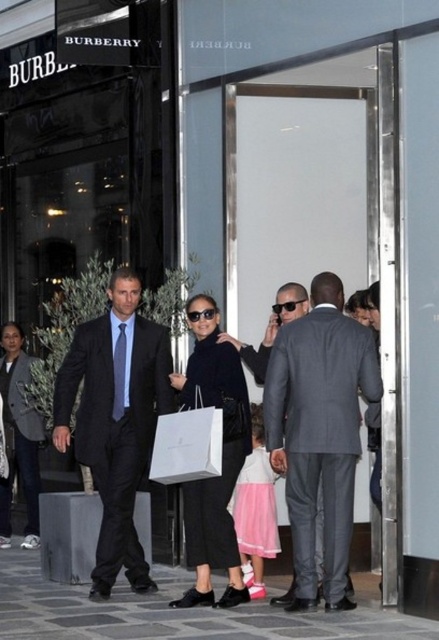
Question: Which object is farther from the camera taking this photo?

Choices:
 (A) pink satin dress at center
 (B) black leather coat at center

Answer: (A)

Question: Estimate the real-world distances between objects in this image. Which object is farther from the pink satin dress at center?

Choices:
 (A) matte black tie at left
 (B) gray suit at center
 (C) dark blue suit at center

Answer: (A)

Question: Is gray suit at center above pink satin dress at center?

Choices:
 (A) no
 (B) yes

Answer: (B)

Question: Which of the following is the closest to the observer?

Choices:
 (A) dark gray textured suit at left
 (B) black leather coat at center
 (C) matte black tie at left
 (D) dark blue suit at center

Answer: (B)

Question: Can you confirm if black leather coat at center is positioned to the left of matte black tie at left?

Choices:
 (A) no
 (B) yes

Answer: (A)

Question: Does gray suit at center appear on the right side of black leather coat at center?

Choices:
 (A) yes
 (B) no

Answer: (A)